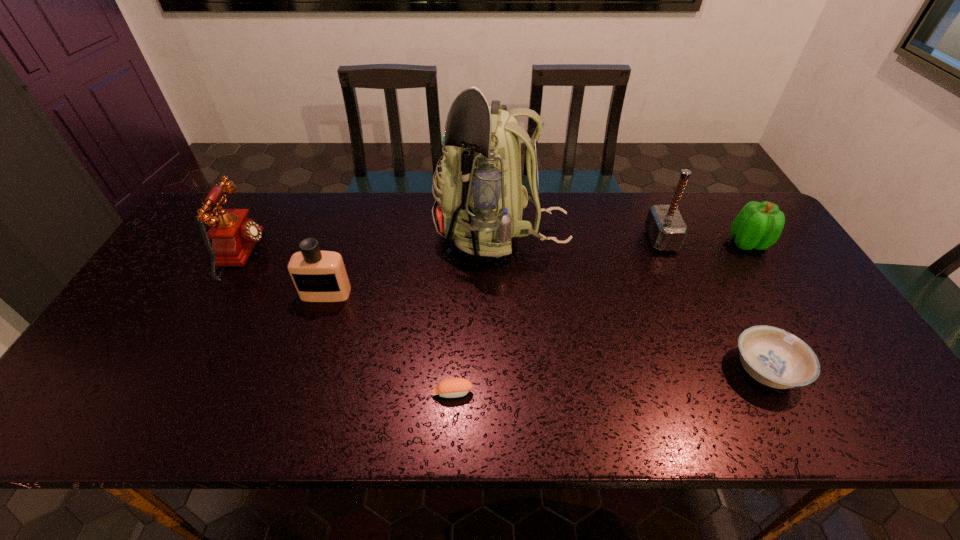
In the image, there is a desktop. At what (x,y) coordinates should I click in order to perform the action: click on free space at the far edge. Please return your answer as a coordinate pair (x, y). The image size is (960, 540). Looking at the image, I should click on (581, 214).

The image size is (960, 540). In order to click on vacant area at the right edge of the desktop in this screenshot , I will do `click(841, 352)`.

You are a GUI agent. You are given a task and a screenshot of the screen. Output one action in this format:
    pyautogui.click(x=<x>, y=<y>)
    Task: Click on the blank area at the far left corner
    The width and height of the screenshot is (960, 540).
    Given the screenshot: What is the action you would take?
    pyautogui.click(x=256, y=194)

In the image, there is a desktop. Where is `blank space at the far right corner`? Image resolution: width=960 pixels, height=540 pixels. blank space at the far right corner is located at coordinates (742, 205).

I want to click on blank space at the near right corner of the desktop, so click(x=822, y=403).

Locate an element on the screen. The width and height of the screenshot is (960, 540). empty location between the fifth farthest object and the bowl is located at coordinates point(546,332).

Identify the location of vacant area that lies between the hammer and the second object from left to right. (493, 266).

You are a GUI agent. You are given a task and a screenshot of the screen. Output one action in this format:
    pyautogui.click(x=<x>, y=<y>)
    Task: Click on the empty space that is in between the telephone and the tallest object
    This screenshot has height=540, width=960.
    Given the screenshot: What is the action you would take?
    pyautogui.click(x=372, y=245)

The width and height of the screenshot is (960, 540). In order to click on vacant point located between the hammer and the leftmost object in this screenshot , I will do `click(452, 247)`.

The width and height of the screenshot is (960, 540). What are the coordinates of `free space between the tallest object and the sushi` in the screenshot? It's located at (477, 314).